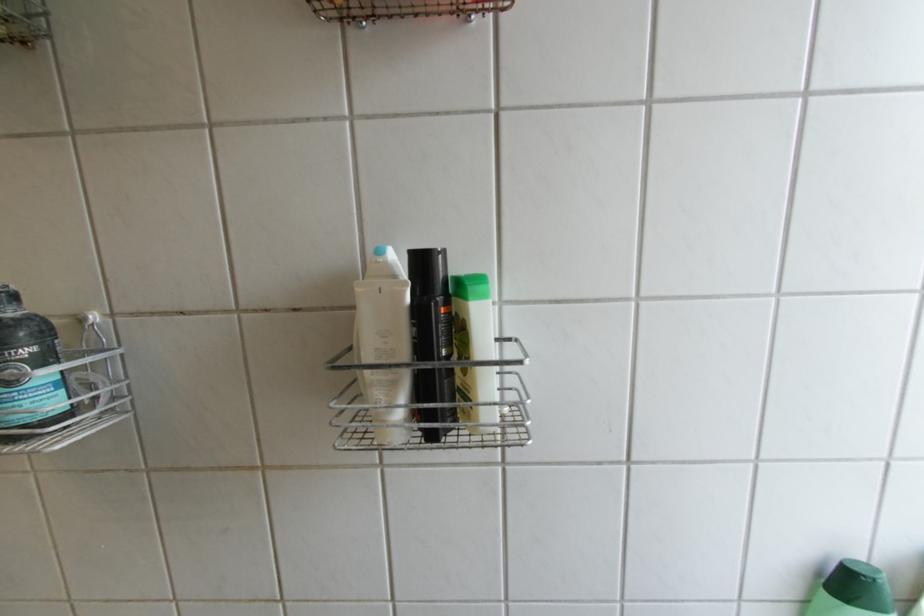
What do you see at coordinates (861, 585) in the screenshot?
I see `a green bottle cap` at bounding box center [861, 585].